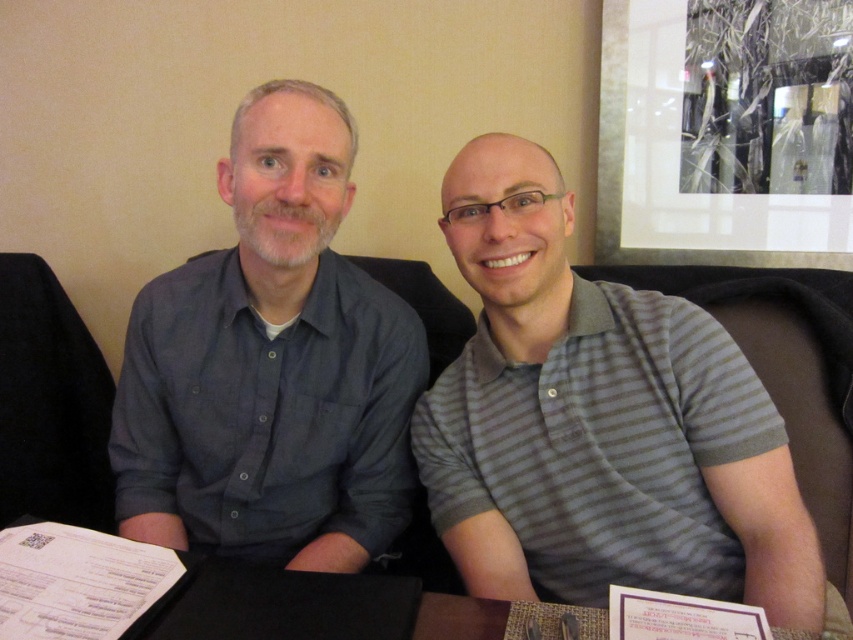
Question: Does dark blue button-down shirt at left have a greater width compared to gray striped polo shirt at center?

Choices:
 (A) no
 (B) yes

Answer: (A)

Question: Is dark blue button-down shirt at left below black leather table at lower center?

Choices:
 (A) yes
 (B) no

Answer: (B)

Question: Which object is closer to the camera taking this photo?

Choices:
 (A) black leather table at lower center
 (B) dark blue button-down shirt at left

Answer: (A)

Question: Which object is positioned farthest from the black leather table at lower center?

Choices:
 (A) dark blue button-down shirt at left
 (B) gray striped polo shirt at center

Answer: (A)

Question: Which of the following is the farthest from the observer?

Choices:
 (A) [351, 621]
 (B) [256, 465]

Answer: (B)

Question: Can you confirm if dark blue button-down shirt at left is bigger than gray striped polo shirt at center?

Choices:
 (A) yes
 (B) no

Answer: (B)